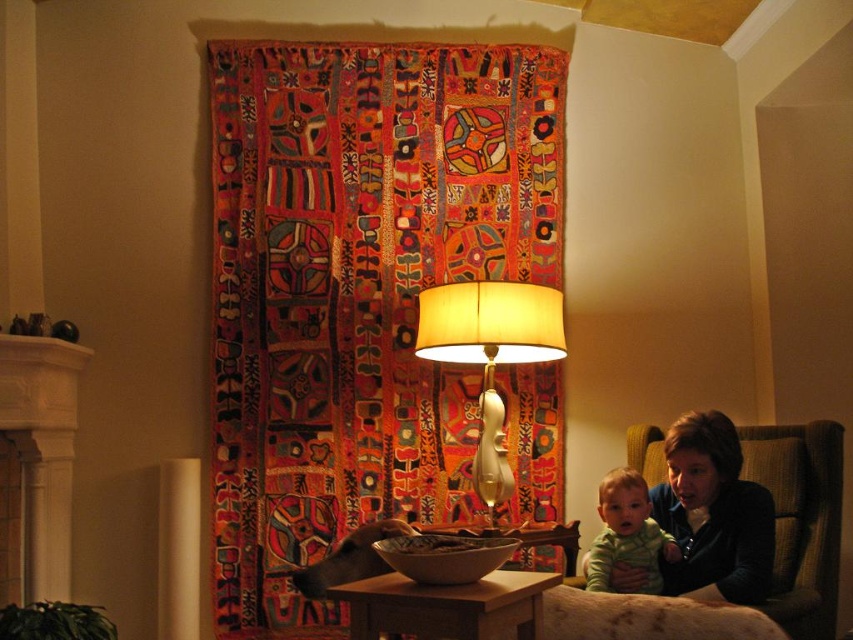
Looking at this image, you are a guest entering the living room and see the dark brown leather jacket at lower right and the wooden table at center. Which object is taller?

The dark brown leather jacket at lower right is taller than the wooden table at center.

You are standing in the living room and want to place a new decorative item exactly where the multicolored woven tapestry at upper center is currently hanging. Where should you position your new item?

You should position your new item at point (357,291), where the multicolored woven tapestry at upper center is currently located.